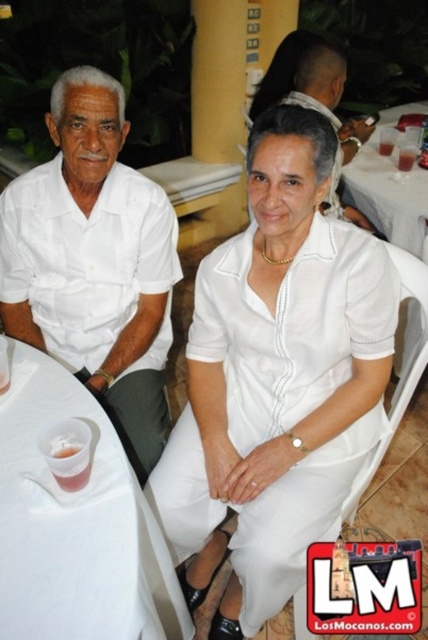
You are a waiter at this restaurant and need to place a new drink order for the customer wearing the matte white shirt at left. The drink must be placed within 12 inches of their current clear plastic cup at lower left. Can you position the new drink in compliance with this requirement?

The distance between the matte white shirt at left and the clear plastic cup at lower left is 15.91 inches. Since the required placement is within 12 inches, the new drink cannot be placed close enough to meet the requirement without moving the existing cup.

From the picture: You are standing in a restaurant and want to place a new table at point (344, 381). The restaurant has a height restriction of 4 feet. Is the point suitable for placing the table?

The distance of point (344, 381) from viewer is 4.01 feet, which exceeds the 4 feet height restriction. Therefore, the table cannot be placed there.

You are standing in front of the table where the man and woman are sitting. There are two points marked on the table. One is at coordinate point [160,384] and the other is at point [80,401]. Which point is closer to you?

Point [160,384] is closer to you because it is further to the viewer than point [80,401].